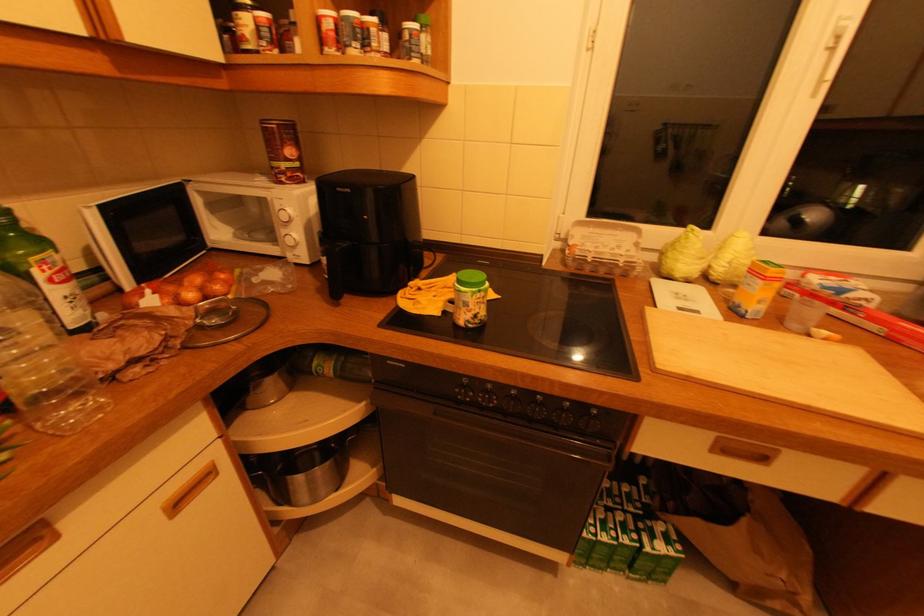
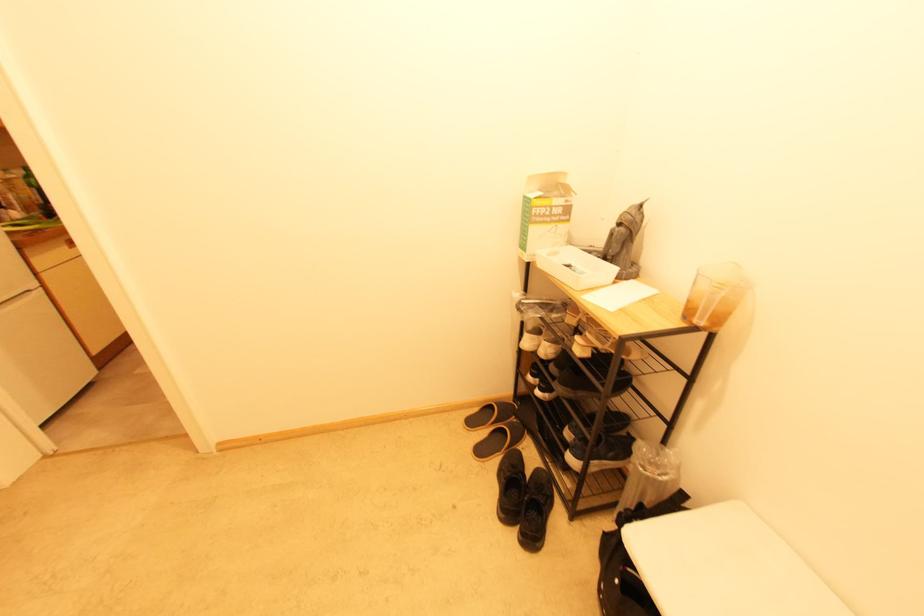
Question: Which direction would the cameraman need to move to produce the second image? Reply with the corresponding letter.

Choices:
 (A) Left
 (B) Right
 (C) Forward
 (D) Backward

Answer: (D)